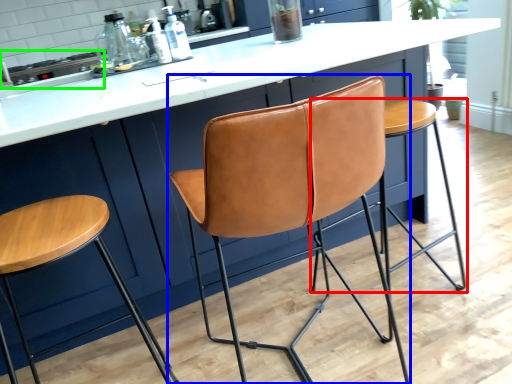
Question: Which is nearer to the stool (highlighted by a red box)? chair (highlighted by a blue box) or appliance (highlighted by a green box).

Choices:
 (A) chair
 (B) appliance

Answer: (A)